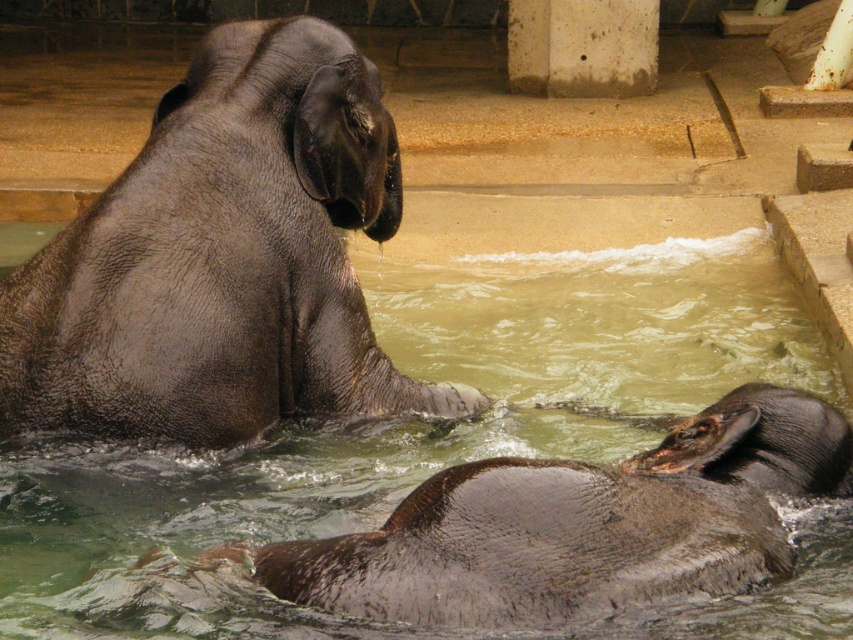
You are a zookeeper who needs to ensure that the gray matte elephant at upper left and the shiny brown elephant at lower center are within the same enclosure. Given that the enclosure can only safely accommodate one large elephant, is the current arrangement safe?

The gray matte elephant at upper left is larger in size than the shiny brown elephant at lower center. Since the enclosure can only safely accommodate one large elephant, the current arrangement is unsafe because there are two elephants, and the gray matte elephant at upper left qualifies as large.

You are a zookeeper observing the two elephants in their enclosure. The gray matte elephant at upper left and the shiny brown elephant at lower center are both in the water. Which elephant is taller?

The gray matte elephant at upper left is taller than the shiny brown elephant at lower center.